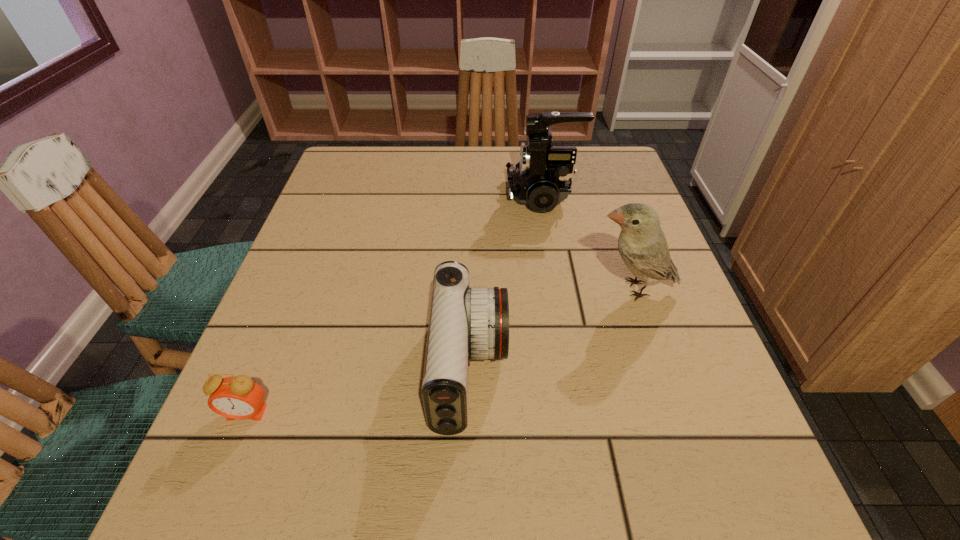
This screenshot has width=960, height=540. In order to click on the right camcorder in this screenshot , I will do `click(542, 179)`.

This screenshot has width=960, height=540. Find the location of `the taller camcorder`. the taller camcorder is located at coordinates (542, 179).

The image size is (960, 540). I want to click on bird, so click(642, 245).

This screenshot has width=960, height=540. What are the coordinates of `the left camcorder` in the screenshot? It's located at (465, 323).

You are a GUI agent. You are given a task and a screenshot of the screen. Output one action in this format:
    pyautogui.click(x=<x>, y=<y>)
    Task: Click on the third tallest object
    This screenshot has width=960, height=540.
    Given the screenshot: What is the action you would take?
    pyautogui.click(x=465, y=323)

The height and width of the screenshot is (540, 960). Find the location of `alarm clock`. alarm clock is located at coordinates (239, 397).

At what (x,y) coordinates should I click in order to perform the action: click on the leftmost object. Please return your answer as a coordinate pair (x, y). The width and height of the screenshot is (960, 540). Looking at the image, I should click on (239, 397).

The height and width of the screenshot is (540, 960). What are the coordinates of `vacant space situated on the lens mount of the taller camcorder` in the screenshot? It's located at (447, 195).

Locate an element on the screen. This screenshot has height=540, width=960. free space located 0.330m on the lens mount of the taller camcorder is located at coordinates (376, 195).

I want to click on free point located 0.370m on the lens mount of the taller camcorder, so click(x=360, y=195).